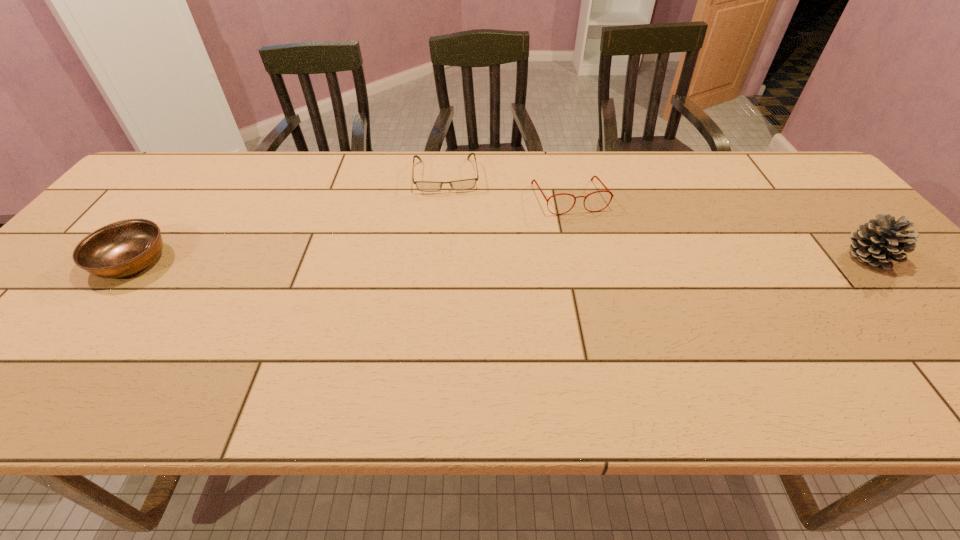
At what (x,y) coordinates should I click in order to perform the action: click on vacant space on the desktop that is between the soup bowl and the tallest object and is positioned on the front-facing side of the left spectacles. Please return your answer as a coordinate pair (x, y). The image size is (960, 540). Looking at the image, I should click on (451, 259).

You are a GUI agent. You are given a task and a screenshot of the screen. Output one action in this format:
    pyautogui.click(x=<x>, y=<y>)
    Task: Click on the vacant space on the desktop that is between the second shortest object and the rightmost object and is positioned on the face of the second object from right to left
    
    Given the screenshot: What is the action you would take?
    pyautogui.click(x=597, y=259)